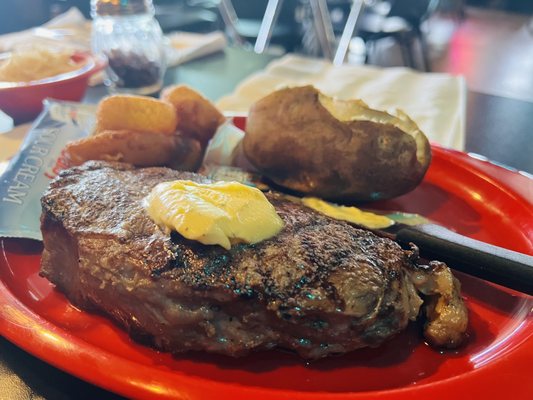
I want to click on napkin, so click(11, 147), click(410, 98).